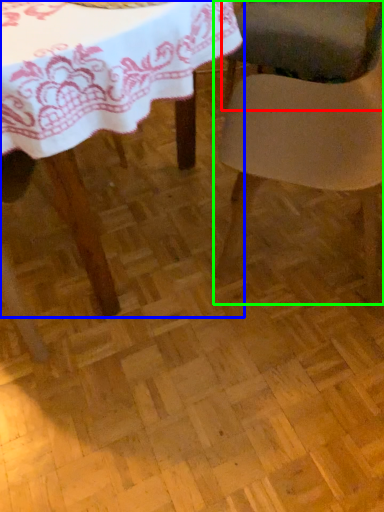
Question: Which is farther away from chair (highlighted by a red box)? table (highlighted by a blue box) or chair (highlighted by a green box)?

Choices:
 (A) table
 (B) chair

Answer: (A)